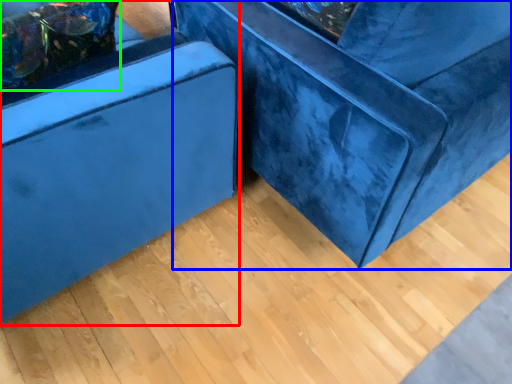
Question: Which object is the farthest from furniture (highlighted by a red box)? Choose among these: furniture (highlighted by a blue box) or pillow (highlighted by a green box).

Choices:
 (A) furniture
 (B) pillow

Answer: (A)